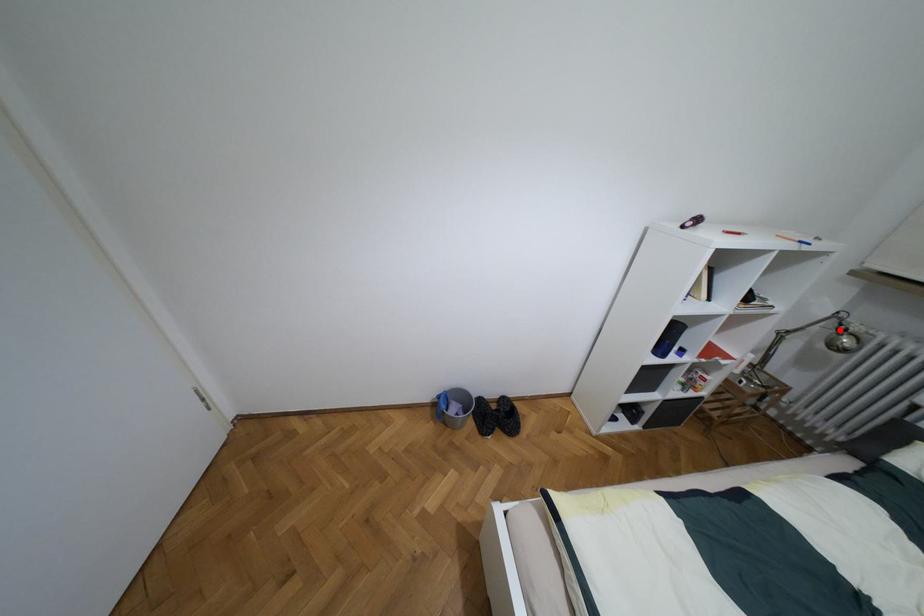
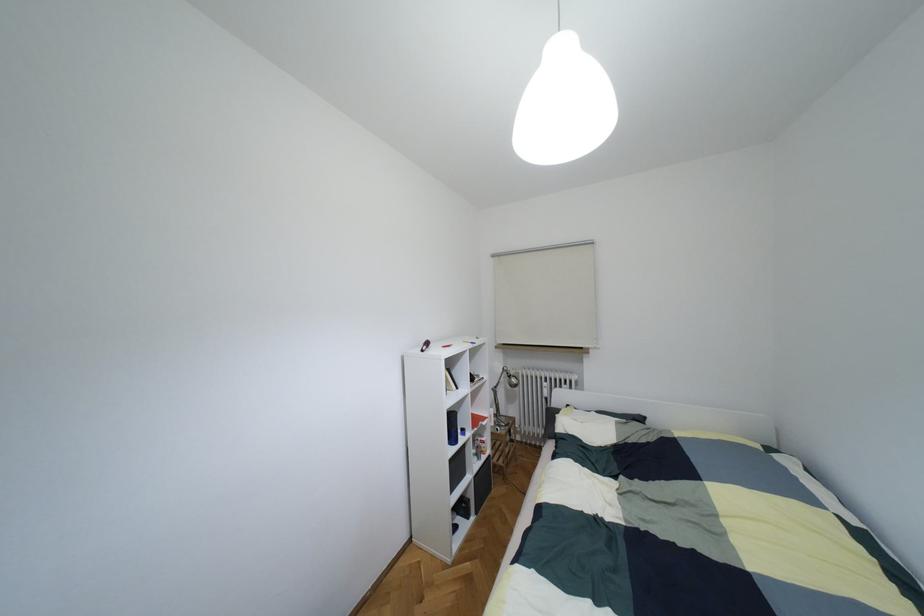
In the second image, find the point that corresponds to the highlighted location in the first image.

(508, 376)